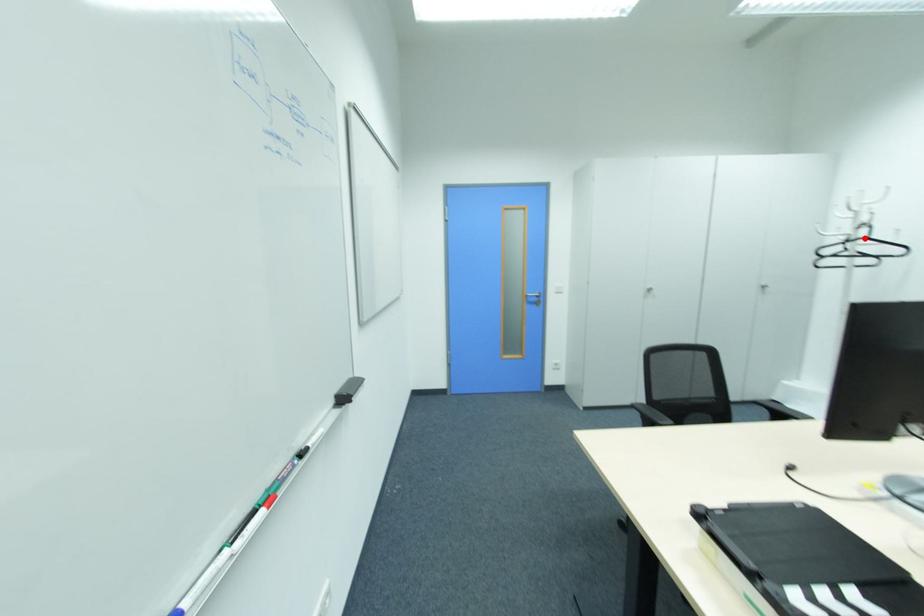
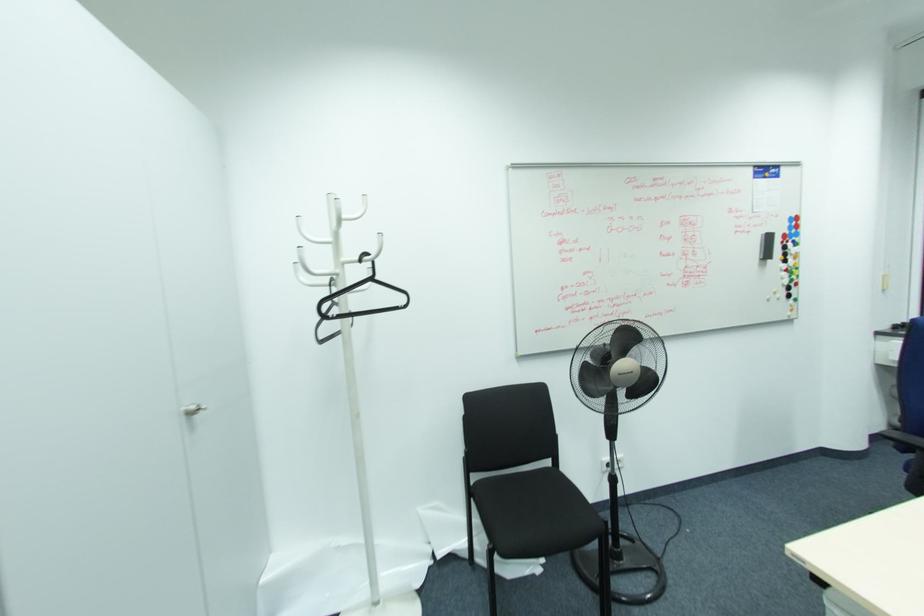
The point at the highlighted location is marked in the first image. Where is the corresponding point in the second image?

(371, 280)